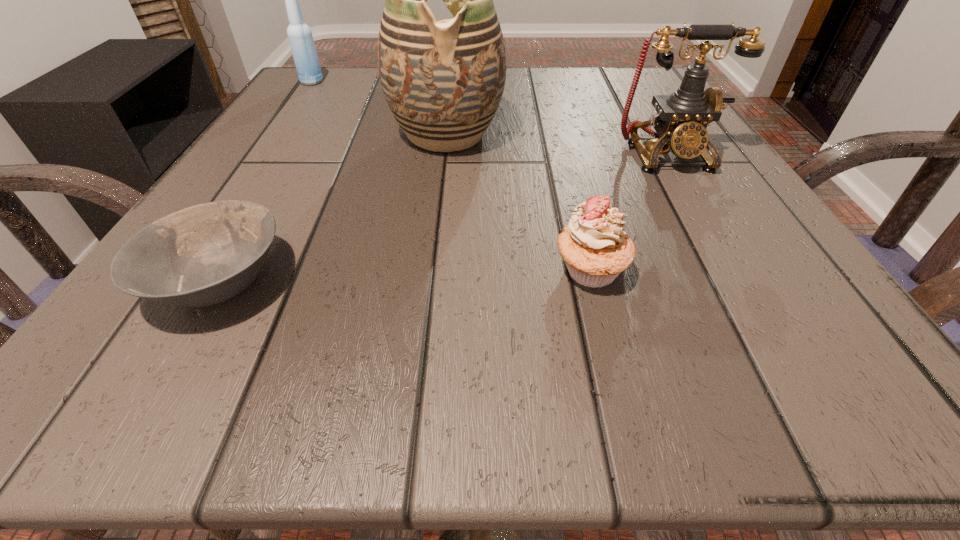
The image size is (960, 540). I want to click on vacant space located 0.340m on the back of the bowl, so click(315, 117).

You are a GUI agent. You are given a task and a screenshot of the screen. Output one action in this format:
    pyautogui.click(x=<x>, y=<y>)
    Task: Click on the pottery positioned at the far edge
    The width and height of the screenshot is (960, 540).
    Given the screenshot: What is the action you would take?
    pyautogui.click(x=443, y=81)

The height and width of the screenshot is (540, 960). I want to click on bottle present at the far edge, so click(x=300, y=37).

Where is `object present at the near edge`? The height and width of the screenshot is (540, 960). object present at the near edge is located at coordinates (202, 255).

Identify the location of bottle that is at the left edge. The image size is (960, 540). (300, 37).

This screenshot has width=960, height=540. I want to click on bowl that is at the left edge, so click(202, 255).

Locate an element on the screen. This screenshot has height=540, width=960. object that is positioned at the right edge is located at coordinates (681, 121).

Image resolution: width=960 pixels, height=540 pixels. I want to click on object at the far left corner, so click(x=300, y=37).

Find the location of a particular element. This screenshot has height=540, width=960. object that is at the near left corner is located at coordinates (202, 255).

You are a GUI agent. You are given a task and a screenshot of the screen. Output one action in this format:
    pyautogui.click(x=<x>, y=<y>)
    Task: Click on the free space at the far edge of the desktop
    
    Given the screenshot: What is the action you would take?
    pyautogui.click(x=553, y=103)